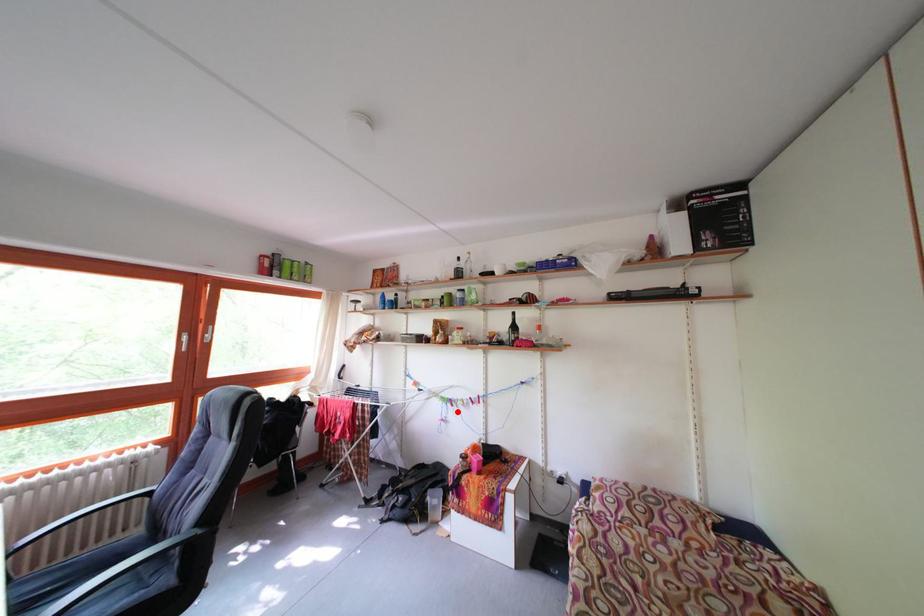
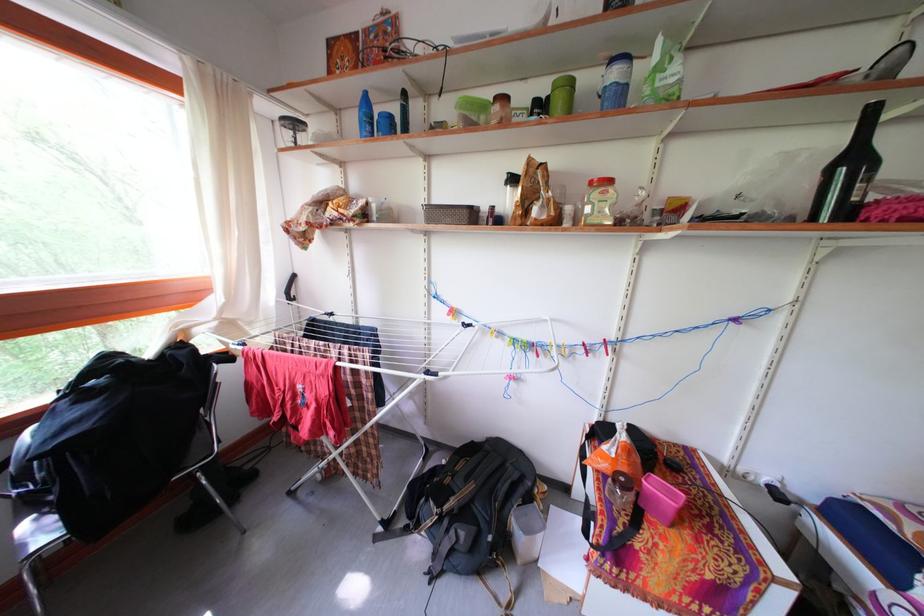
Find the pixel in the second image that matches the highlighted location in the first image.

(540, 361)